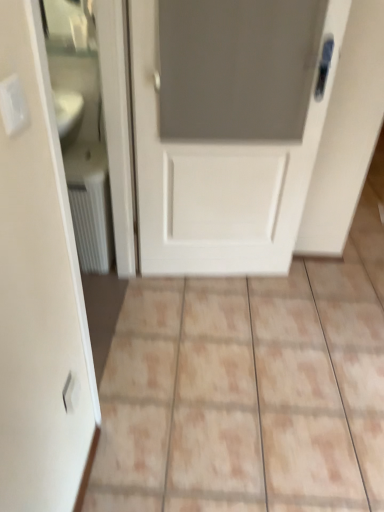
Question: From a real-world perspective, is white textured radiator at left above or below white plastic electric outlet at lower left, the first electric outlet ordered from the bottom?

Choices:
 (A) below
 (B) above

Answer: (A)

Question: Considering the positions of white textured radiator at left and white plastic electric outlet at lower left, which ranks as the second electric outlet in top-to-bottom order, in the image, is white textured radiator at left wider or thinner than white plastic electric outlet at lower left, which ranks as the second electric outlet in top-to-bottom order,?

Choices:
 (A) wide
 (B) thin

Answer: (A)

Question: Which object is positioned closest to the white plastic electric outlet at lower left, which ranks as the second electric outlet in top-to-bottom order?

Choices:
 (A) white matte door at center
 (B) white textured radiator at left
 (C) white plastic electric outlet at upper left, acting as the 2th electric outlet starting from the bottom
 (D) beige ceramic tile at center

Answer: (C)

Question: Which of these objects is positioned closest to the white plastic electric outlet at upper left, the second electric outlet viewed from the back?

Choices:
 (A) white textured radiator at left
 (B) beige ceramic tile at center
 (C) white matte door at center
 (D) white plastic electric outlet at lower left, the first electric outlet ordered from the bottom

Answer: (D)